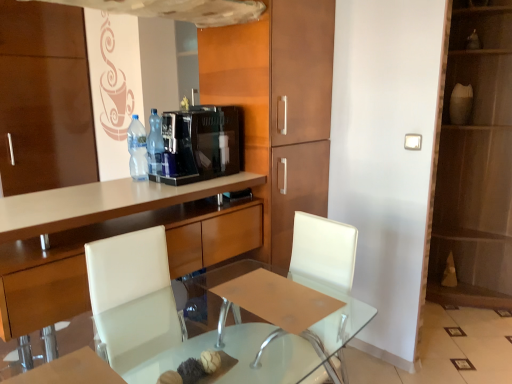
The height and width of the screenshot is (384, 512). I want to click on blank space situated above wooden cabinet at center, which appears as the second cabinetry when viewed from the right (from a real-world perspective), so click(x=91, y=196).